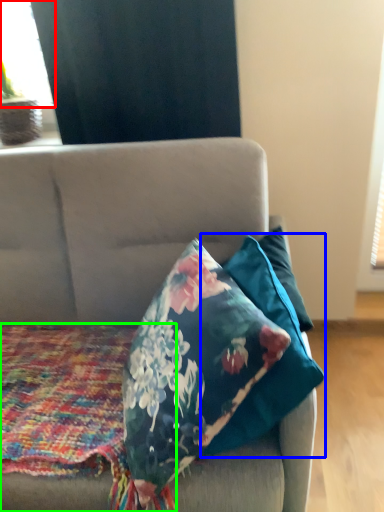
Question: Considering the real-world distances, which object is farthest from window screen (highlighted by a red box)? pillow (highlighted by a blue box) or blanket (highlighted by a green box)?

Choices:
 (A) pillow
 (B) blanket

Answer: (A)